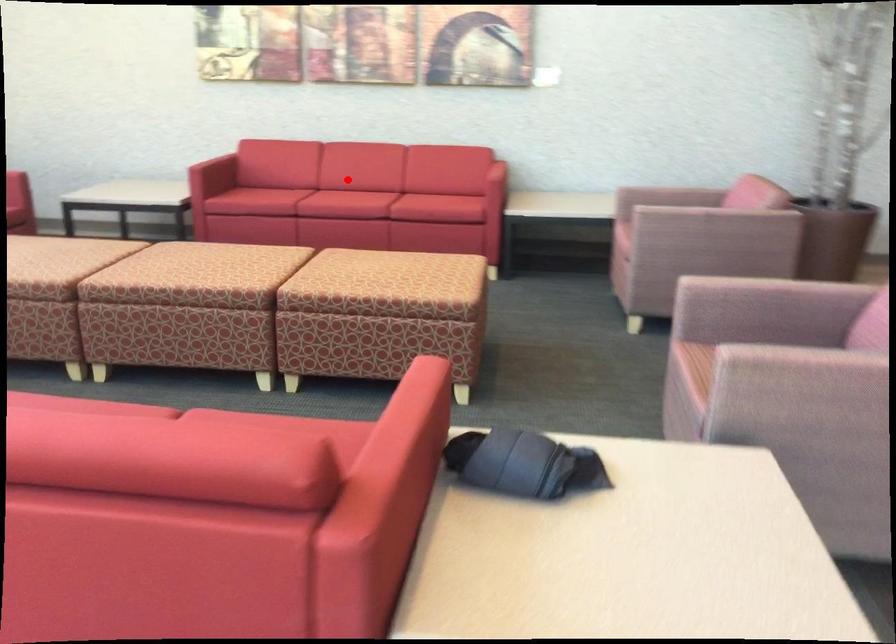
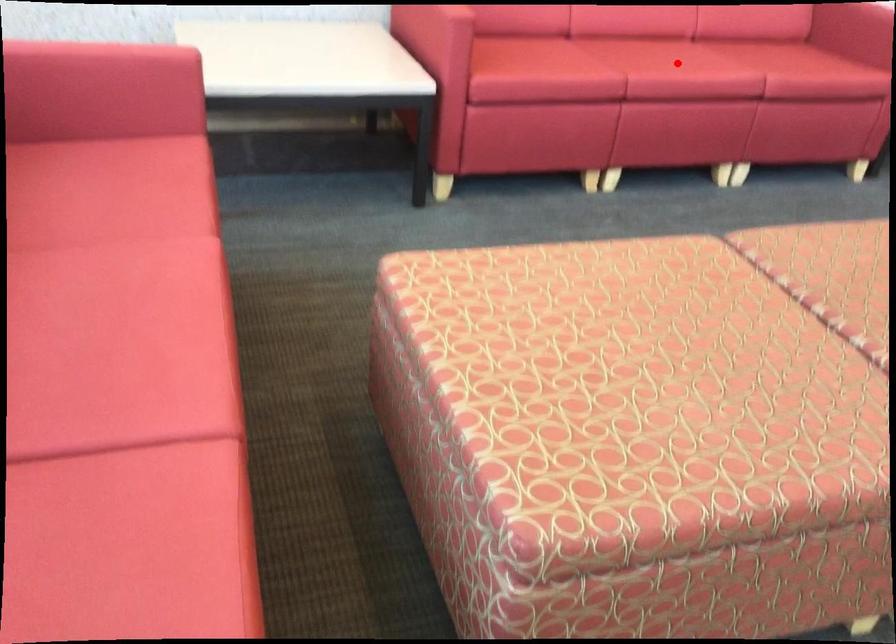
I am providing you with two images of the same scene from different viewpoints. A red point is marked on the first image and another point is marked on the second image. Are the points marked in image1 and image2 representing the same 3D position?

Yes